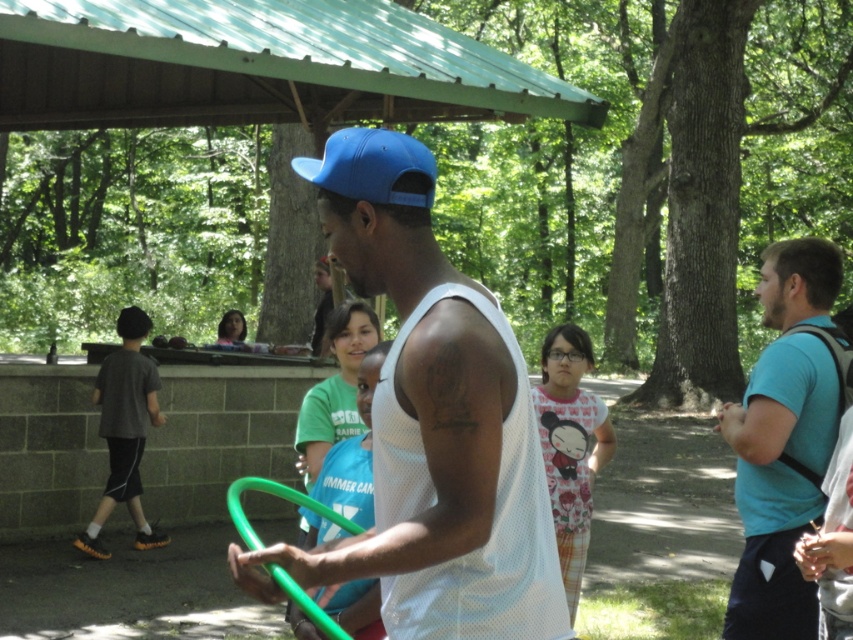
You are standing in the park and see two points marked in the scene. Which point, point (461, 484) or point (759, 509), is closer to you?

Point (461, 484) is closer to the viewer than point (759, 509).

You are standing in the park and see two people wearing different tops. The first person is wearing a white mesh tank top at center, and the second is wearing a blue mesh shirt at right. Which one is positioned more to the right side of the scene?

The blue mesh shirt at right is positioned more to the right side of the scene compared to the white mesh tank top at center.